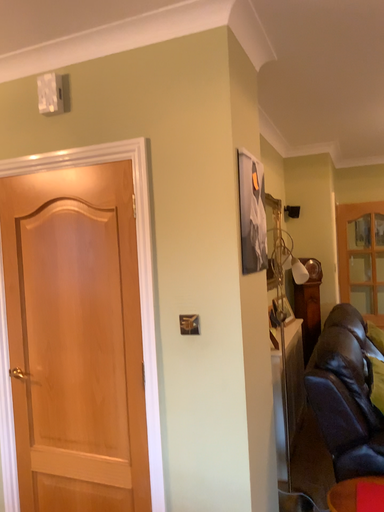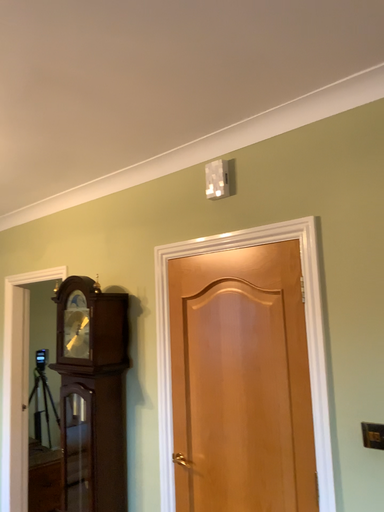
Question: Which way did the camera rotate in the video?

Choices:
 (A) rotated left
 (B) rotated right

Answer: (A)